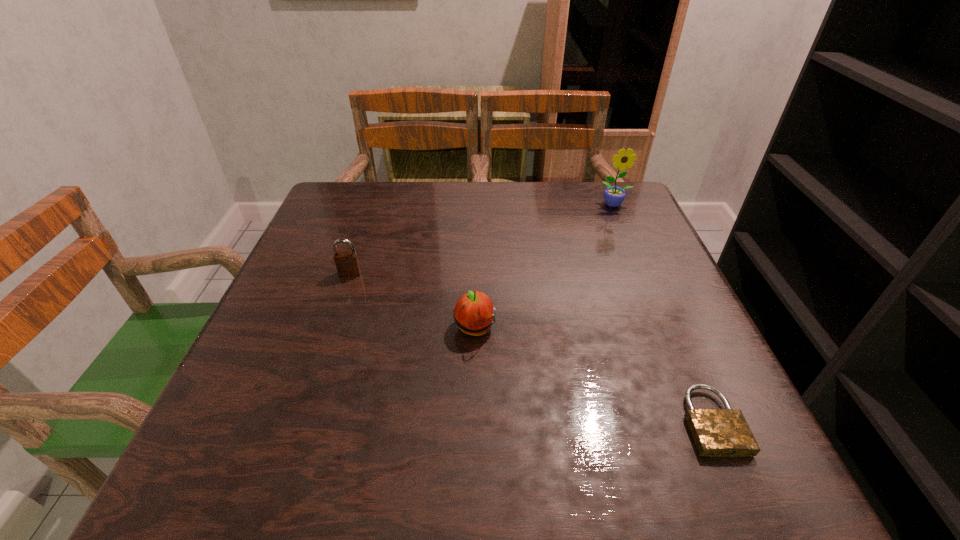
Locate an element on the screen. Image resolution: width=960 pixels, height=540 pixels. vacant region at the left edge of the desktop is located at coordinates [295, 312].

You are a GUI agent. You are given a task and a screenshot of the screen. Output one action in this format:
    pyautogui.click(x=<x>, y=<y>)
    Task: Click on the blank space at the right edge of the desktop
    
    Given the screenshot: What is the action you would take?
    pyautogui.click(x=632, y=274)

This screenshot has width=960, height=540. Identify the location of vacant space at the far left corner of the desktop. (348, 193).

This screenshot has height=540, width=960. In the image, there is a desktop. In order to click on free region at the far right corner in this screenshot , I will do `click(587, 182)`.

In the image, there is a desktop. In order to click on vacant space at the near right corner in this screenshot , I will do `click(687, 470)`.

Find the location of `vacant point located between the taller padlock and the second nearest object`. vacant point located between the taller padlock and the second nearest object is located at coordinates (413, 301).

Locate an element on the screen. free point between the tallest object and the taller padlock is located at coordinates (482, 239).

Locate an element on the screen. free point between the third farthest object and the leftmost object is located at coordinates (413, 301).

Locate an element on the screen. The image size is (960, 540). free space between the leftmost object and the tallest object is located at coordinates (482, 239).

The width and height of the screenshot is (960, 540). What are the coordinates of `vacant area that lies between the farthest object and the third farthest object` in the screenshot? It's located at (544, 267).